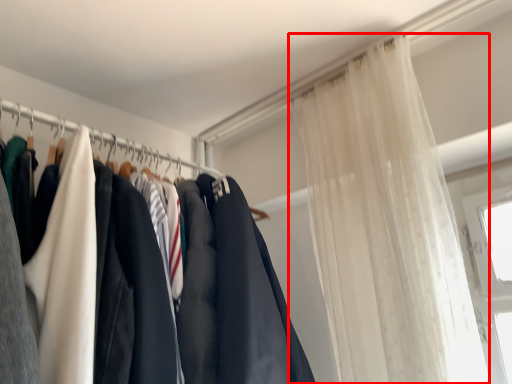
Question: From the image's perspective, considering the relative positions of curtain (annotated by the red box) and clothesline in the image provided, where is curtain (annotated by the red box) located with respect to the staircase?

Choices:
 (A) below
 (B) above

Answer: (A)